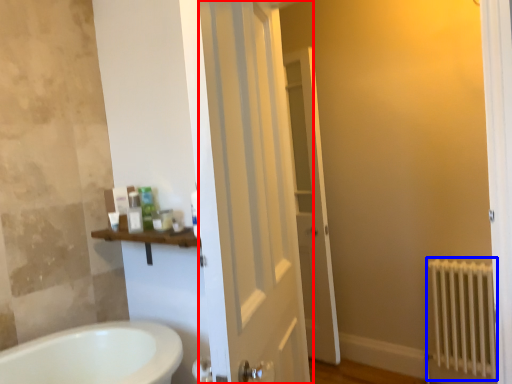
Question: Which object is further to the camera taking this photo, door (highlighted by a red box) or radiator (highlighted by a blue box)?

Choices:
 (A) door
 (B) radiator

Answer: (B)